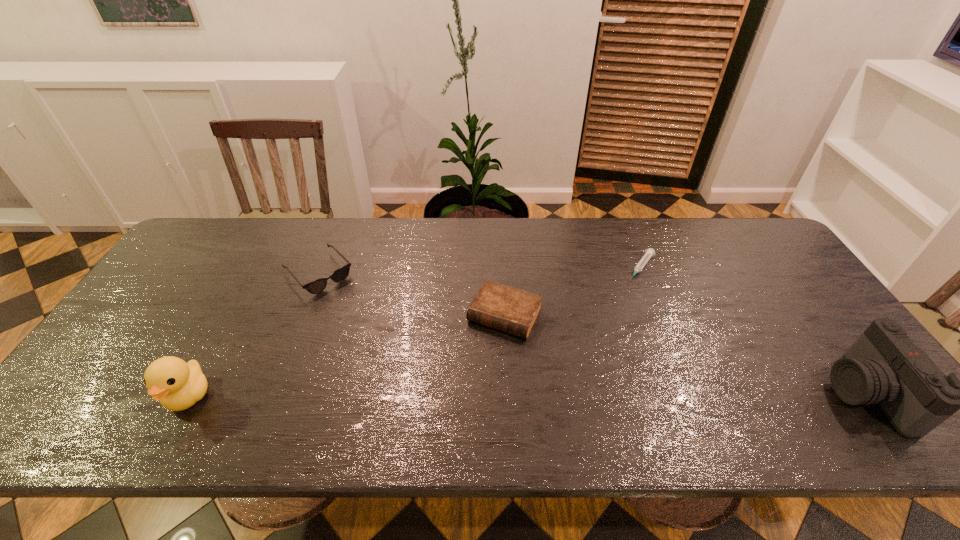
Image resolution: width=960 pixels, height=540 pixels. I want to click on duck, so (178, 385).

Where is `camera`? The height and width of the screenshot is (540, 960). camera is located at coordinates (883, 366).

Find the location of a particular element. the second object from right to left is located at coordinates (650, 252).

This screenshot has height=540, width=960. I want to click on the shortest object, so click(650, 252).

I want to click on the third object from left to right, so click(504, 308).

Where is `the fourth object from right to left`? the fourth object from right to left is located at coordinates point(316,286).

The height and width of the screenshot is (540, 960). I want to click on free space located 0.190m at the lens of the rightmost object, so click(754, 394).

The height and width of the screenshot is (540, 960). Identify the location of vacant region located at the lens of the rightmost object. (685, 394).

Where is `free space located 0.350m at the lens of the rightmost object`? Image resolution: width=960 pixels, height=540 pixels. free space located 0.350m at the lens of the rightmost object is located at coordinates (685, 394).

Locate an element on the screen. Image resolution: width=960 pixels, height=540 pixels. free space located 0.080m at the needle end of the second object from right to left is located at coordinates (624, 295).